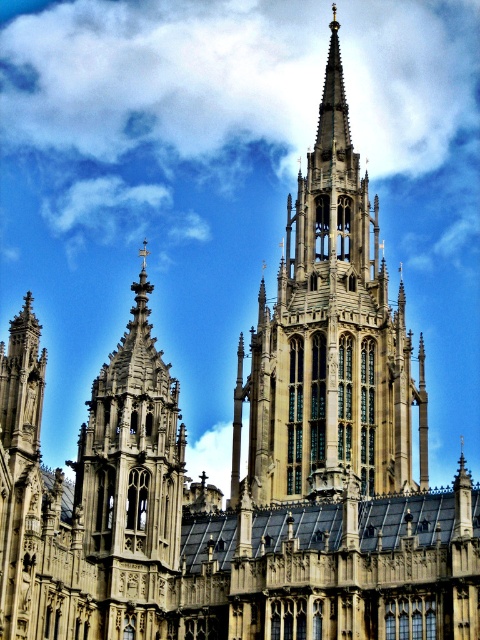
Question: Among these objects, which one is farthest from the camera?

Choices:
 (A) golden stone spire at center
 (B) white fluffy cloud at upper center

Answer: (B)

Question: Does white fluffy cloud at upper center appear over golden stone spire at center?

Choices:
 (A) no
 (B) yes

Answer: (B)

Question: Which object appears closest to the camera in this image?

Choices:
 (A) white fluffy cloud at upper center
 (B) golden stone spire at center

Answer: (B)

Question: Does white fluffy cloud at upper center appear on the left side of golden stone spire at center?

Choices:
 (A) yes
 (B) no

Answer: (A)

Question: Is white fluffy cloud at upper center further to the viewer compared to golden stone spire at center?

Choices:
 (A) no
 (B) yes

Answer: (B)